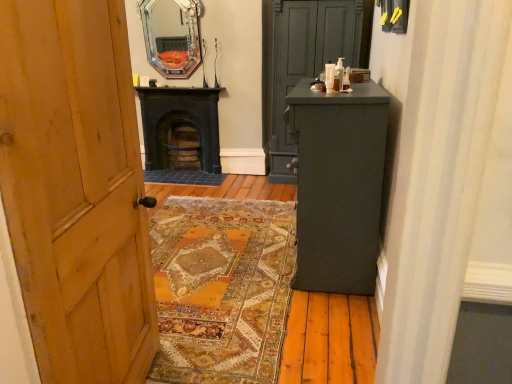
Question: Is black cast iron stove at center at the left side of silver-framed mirror at upper center?

Choices:
 (A) yes
 (B) no

Answer: (B)

Question: Could you tell me if black cast iron stove at center is turned towards silver-framed mirror at upper center?

Choices:
 (A) yes
 (B) no

Answer: (B)

Question: Is black cast iron stove at center thinner than silver-framed mirror at upper center?

Choices:
 (A) no
 (B) yes

Answer: (A)

Question: Is black cast iron stove at center bigger than silver-framed mirror at upper center?

Choices:
 (A) no
 (B) yes

Answer: (B)

Question: Considering the relative sizes of black cast iron stove at center and silver-framed mirror at upper center in the image provided, is black cast iron stove at center shorter than silver-framed mirror at upper center?

Choices:
 (A) no
 (B) yes

Answer: (A)

Question: Is black cast iron stove at center spatially inside matte gray cabinet at center, or outside of it?

Choices:
 (A) outside
 (B) inside

Answer: (A)

Question: In terms of width, does black cast iron stove at center look wider or thinner when compared to matte gray cabinet at center?

Choices:
 (A) thin
 (B) wide

Answer: (A)

Question: Is black cast iron stove at center to the left or to the right of matte gray cabinet at center in the image?

Choices:
 (A) left
 (B) right

Answer: (A)

Question: From a real-world perspective, relative to matte gray cabinet at center, is black cast iron stove at center vertically above or below?

Choices:
 (A) below
 (B) above

Answer: (A)

Question: Considering their positions, is matte gray cabinet at center located in front of or behind silver-framed mirror at upper center?

Choices:
 (A) front
 (B) behind

Answer: (A)

Question: Is point (285, 168) closer or farther from the camera than point (186, 13)?

Choices:
 (A) farther
 (B) closer

Answer: (A)

Question: From the image's perspective, is matte gray cabinet at center above or below silver-framed mirror at upper center?

Choices:
 (A) below
 (B) above

Answer: (A)

Question: Looking at their shapes, would you say matte gray cabinet at center is wider or thinner than silver-framed mirror at upper center?

Choices:
 (A) thin
 (B) wide

Answer: (B)

Question: Is matte dark gray cabinet at right wider or thinner than black cast iron stove at center?

Choices:
 (A) wide
 (B) thin

Answer: (A)

Question: Relative to black cast iron stove at center, is matte dark gray cabinet at right in front or behind?

Choices:
 (A) front
 (B) behind

Answer: (A)